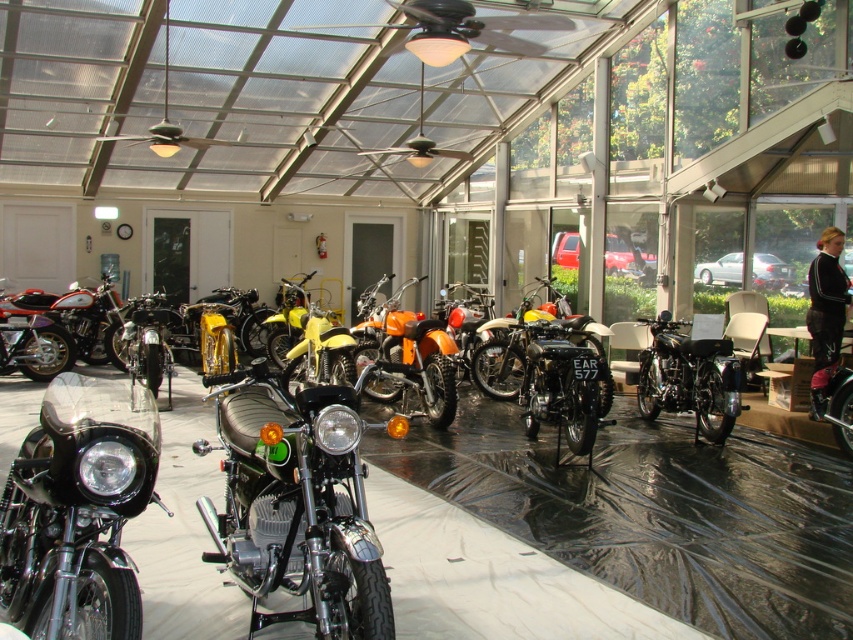
Which of these two, black polished motorcycle at left or shiny black motorcycle at center, stands shorter?

With less height is black polished motorcycle at left.

Is point (20, 612) positioned in front of point (648, 388)?

Yes, point (20, 612) is closer to viewer.

The height and width of the screenshot is (640, 853). In order to click on black polished motorcycle at left in this screenshot , I will do `click(78, 509)`.

Does shiny black motorcycle at center appear on the right side of shiny chrome motorcycle at left?

Correct, you'll find shiny black motorcycle at center to the right of shiny chrome motorcycle at left.

Is shiny black motorcycle at center smaller than shiny chrome motorcycle at left?

Correct, shiny black motorcycle at center occupies less space than shiny chrome motorcycle at left.

Describe the element at coordinates (689, 378) in the screenshot. I see `shiny black motorcycle at center` at that location.

The height and width of the screenshot is (640, 853). Identify the location of shiny black motorcycle at center. (689, 378).

Between black polished motorcycle at left and orange matte motorcycle at center, which one has more height?

black polished motorcycle at left

Is point (107, 454) positioned in front of point (444, 353)?

Yes, point (107, 454) is in front of point (444, 353).

The image size is (853, 640). What do you see at coordinates (78, 509) in the screenshot? I see `black polished motorcycle at left` at bounding box center [78, 509].

This screenshot has height=640, width=853. What are the coordinates of `black polished motorcycle at left` in the screenshot? It's located at (78, 509).